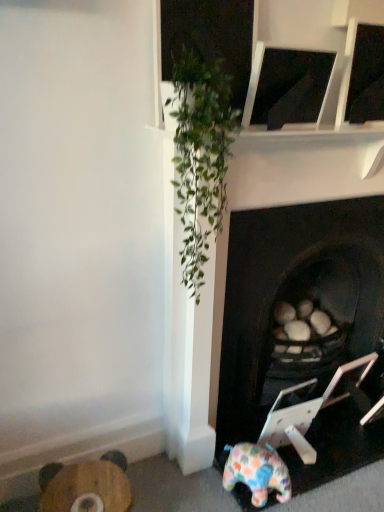
Where is `multicolored plush elephant at lower right`? The image size is (384, 512). multicolored plush elephant at lower right is located at coordinates (257, 472).

Measure the distance between point (68, 503) and camera.

Point (68, 503) and camera are 4.02 feet apart.

Locate an element on the screen. The width and height of the screenshot is (384, 512). dark wood fireplace at center is located at coordinates (296, 303).

From the image's perspective, which one is positioned lower, wooden stool at lower left or multicolored plush elephant at lower right?

From the image's view, wooden stool at lower left is below.

From a real-world perspective, is wooden stool at lower left positioned above or below multicolored plush elephant at lower right?

wooden stool at lower left is situated lower than multicolored plush elephant at lower right in the real world.

Does wooden stool at lower left have a greater height compared to multicolored plush elephant at lower right?

Correct, wooden stool at lower left is much taller as multicolored plush elephant at lower right.

Considering the relative sizes of wooden stool at lower left and multicolored plush elephant at lower right in the image provided, is wooden stool at lower left bigger than multicolored plush elephant at lower right?

Indeed, wooden stool at lower left has a larger size compared to multicolored plush elephant at lower right.

In order to click on fireplace located on the right of multicolored plush elephant at lower right in this screenshot , I will do `click(296, 303)`.

Is dark wood fireplace at center positioned beyond the bounds of multicolored plush elephant at lower right?

Yes, dark wood fireplace at center is located beyond the bounds of multicolored plush elephant at lower right.

Is dark wood fireplace at center to the left of multicolored plush elephant at lower right from the viewer's perspective?

Incorrect, dark wood fireplace at center is not on the left side of multicolored plush elephant at lower right.

Is dark wood fireplace at center turned away from multicolored plush elephant at lower right?

No, dark wood fireplace at center is not facing the opposite direction of multicolored plush elephant at lower right.

Is multicolored plush elephant at lower right at the left side of dark wood fireplace at center?

Yes.

Is multicolored plush elephant at lower right next to dark wood fireplace at center?

multicolored plush elephant at lower right and dark wood fireplace at center are not in contact.

Is multicolored plush elephant at lower right oriented away from dark wood fireplace at center?

Absolutely, multicolored plush elephant at lower right is directed away from dark wood fireplace at center.

From the picture: From the image's perspective, is multicolored plush elephant at lower right above dark wood fireplace at center?

No, from the image's perspective, multicolored plush elephant at lower right is not over dark wood fireplace at center.

There is a wooden stool at lower left. Where is `fireplace above it (from a real-world perspective)`? The height and width of the screenshot is (512, 384). fireplace above it (from a real-world perspective) is located at coordinates 296,303.

Between wooden stool at lower left and dark wood fireplace at center, which one is positioned behind?

wooden stool at lower left is more distant.

Considering the relative sizes of wooden stool at lower left and dark wood fireplace at center in the image provided, is wooden stool at lower left smaller than dark wood fireplace at center?

Correct, wooden stool at lower left occupies less space than dark wood fireplace at center.

What's the angular difference between wooden stool at lower left and dark wood fireplace at center's facing directions?

7.02 degrees.

How many degrees apart are the facing directions of dark wood fireplace at center and wooden stool at lower left?

The angular difference between dark wood fireplace at center and wooden stool at lower left is 7.02 degrees.

Can you confirm if dark wood fireplace at center is taller than wooden stool at lower left?

Indeed, dark wood fireplace at center has a greater height compared to wooden stool at lower left.

Looking at this image, from a real-world perspective, is dark wood fireplace at center on top of wooden stool at lower left?

Yes, from a real-world perspective, dark wood fireplace at center is over wooden stool at lower left

Could you tell me if dark wood fireplace at center is turned towards wooden stool at lower left?

No, dark wood fireplace at center is not facing towards wooden stool at lower left.

Which object is further away from the camera, multicolored plush elephant at lower right or wooden stool at lower left?

Positioned behind is multicolored plush elephant at lower right.

Looking at their sizes, would you say multicolored plush elephant at lower right is wider or thinner than wooden stool at lower left?

In the image, multicolored plush elephant at lower right appears to be wider than wooden stool at lower left.

From a real-world perspective, between multicolored plush elephant at lower right and wooden stool at lower left, who is vertically lower?

From a 3D spatial view, wooden stool at lower left is below.

Image resolution: width=384 pixels, height=512 pixels. I want to click on toy behind the wooden stool at lower left, so click(x=257, y=472).

Find the location of a particular element. This screenshot has width=384, height=512. toy below the dark wood fireplace at center (from a real-world perspective) is located at coordinates (257, 472).

When comparing their distances from multicolored plush elephant at lower right, does wooden stool at lower left or dark wood fireplace at center seem closer?

The object closer to multicolored plush elephant at lower right is dark wood fireplace at center.

From the image, which object appears to be farther from wooden stool at lower left, dark wood fireplace at center or multicolored plush elephant at lower right?

The object further to wooden stool at lower left is dark wood fireplace at center.

Estimate the real-world distances between objects in this image. Which object is further from multicolored plush elephant at lower right, dark wood fireplace at center or wooden stool at lower left?

wooden stool at lower left is positioned further to the anchor multicolored plush elephant at lower right.

Looking at the image, which one is located closer to dark wood fireplace at center, wooden stool at lower left or multicolored plush elephant at lower right?

multicolored plush elephant at lower right.

Estimate the real-world distances between objects in this image. Which object is closer to dark wood fireplace at center, multicolored plush elephant at lower right or wooden stool at lower left?

The object closer to dark wood fireplace at center is multicolored plush elephant at lower right.

When comparing their distances from wooden stool at lower left, does multicolored plush elephant at lower right or dark wood fireplace at center seem further?

Based on the image, dark wood fireplace at center appears to be further to wooden stool at lower left.

Find the location of a particular element. The width and height of the screenshot is (384, 512). toy located between wooden stool at lower left and dark wood fireplace at center in the left-right direction is located at coordinates (257, 472).